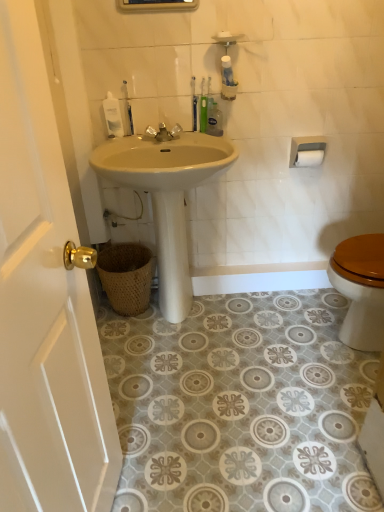
What do you see at coordinates (163, 133) in the screenshot?
I see `metallic faucet at center` at bounding box center [163, 133].

What do you see at coordinates (126, 276) in the screenshot?
I see `woven brown basket at lower left` at bounding box center [126, 276].

Find the location of a particular element. This screenshot has width=384, height=512. woven brown basket at lower left is located at coordinates (126, 276).

Find the location of a particular element. The height and width of the screenshot is (512, 384). white matte soap at upper center is located at coordinates (224, 35).

At what (x,y) coordinates should I click in order to perform the action: click on metallic faucet at center. Please return your answer as a coordinate pair (x, y). This screenshot has height=512, width=384. Looking at the image, I should click on (163, 133).

Is white plastic toilet paper holder at upper right surrounded by white matte toilet paper at upper right?

Definitely not — white plastic toilet paper holder at upper right is not inside white matte toilet paper at upper right.

Is white matte toilet paper at upper right in front of or behind white plastic toilet paper holder at upper right in the image?

In the image, white matte toilet paper at upper right appears behind white plastic toilet paper holder at upper right.

Can you tell me how much white matte toilet paper at upper right and white plastic toilet paper holder at upper right differ in facing direction?

white matte toilet paper at upper right and white plastic toilet paper holder at upper right are facing 1.89 degrees away from each other.

Locate an element on the screen. towel bar in front of the white matte toilet paper at upper right is located at coordinates (307, 151).

Is white plastic soap dispenser at upper left, the first toiletry in the left-to-right sequence, in contact with white glossy door at left?

No, white plastic soap dispenser at upper left, the first toiletry in the left-to-right sequence, is not touching white glossy door at left.

How many degrees apart are the facing directions of white plastic soap dispenser at upper left, the first toiletry in the left-to-right sequence, and white glossy door at left?

The facing directions of white plastic soap dispenser at upper left, the first toiletry in the left-to-right sequence, and white glossy door at left are 81.9 degrees apart.

Can you confirm if white plastic soap dispenser at upper left, the first toiletry in the left-to-right sequence, is shorter than white glossy door at left?

Indeed, white plastic soap dispenser at upper left, the first toiletry in the left-to-right sequence, has a lesser height compared to white glossy door at left.

Considering the sizes of objects white plastic soap dispenser at upper left, the third toiletry positioned from the right, and white glossy door at left in the image provided, who is bigger, white plastic soap dispenser at upper left, the third toiletry positioned from the right, or white glossy door at left?

Bigger between the two is white glossy door at left.

Can you tell me how much white plastic soap dispenser at upper center, which appears as the second toiletry when viewed from the left, and white plastic soap dispenser at upper left, the first toiletry in the left-to-right sequence, differ in facing direction?

0.000408 degrees separate the facing orientations of white plastic soap dispenser at upper center, which appears as the second toiletry when viewed from the left, and white plastic soap dispenser at upper left, the first toiletry in the left-to-right sequence.

From the image's perspective, is white plastic soap dispenser at upper center, which appears as the second toiletry when viewed from the left, below white plastic soap dispenser at upper left, the third toiletry positioned from the right?

Actually, white plastic soap dispenser at upper center, which appears as the second toiletry when viewed from the left, appears above white plastic soap dispenser at upper left, the third toiletry positioned from the right, in the image.

Would you say white plastic soap dispenser at upper center, the 2th toiletry in the right-to-left sequence, is inside or outside white plastic soap dispenser at upper left, the first toiletry in the left-to-right sequence?

white plastic soap dispenser at upper center, the 2th toiletry in the right-to-left sequence, is not enclosed by white plastic soap dispenser at upper left, the first toiletry in the left-to-right sequence.

Considering the points (126, 90) and (121, 120), which point is behind, point (126, 90) or point (121, 120)?

Point (121, 120)

Is point (180, 193) behind point (310, 152)?

That is False.

Looking at the image, does white glossy sink at center seem bigger or smaller compared to white matte toilet paper at upper right?

white glossy sink at center is bigger than white matte toilet paper at upper right.

From a real-world perspective, which object rests below the other?

white glossy sink at center is physically lower.

Does white glossy sink at center come in front of white matte toilet paper at upper right?

Yes, white glossy sink at center is closer to the viewer.

Is point (57, 446) positioned before point (319, 159)?

Yes, point (57, 446) is closer to viewer.

Is white glossy door at left oriented towards white matte toilet paper at upper right?

No, white glossy door at left is not aimed at white matte toilet paper at upper right.

Considering the relative positions of white glossy door at left and white matte toilet paper at upper right in the image provided, is white glossy door at left to the left of white matte toilet paper at upper right from the viewer's perspective?

Yes, white glossy door at left is to the left of white matte toilet paper at upper right.

Does point (117, 109) lie in front of point (216, 128)?

Yes, it is.

Visually, is white plastic soap dispenser at upper left, the first toiletry in the left-to-right sequence, positioned to the left or to the right of translucent plastic bottle at upper center, which is the first toiletry from right to left?

white plastic soap dispenser at upper left, the first toiletry in the left-to-right sequence, is to the left of translucent plastic bottle at upper center, which is the first toiletry from right to left.

From a real-world perspective, is white plastic soap dispenser at upper left, the third toiletry positioned from the right, located higher than translucent plastic bottle at upper center, the third toiletry when ordered from left to right?

Indeed, from a real-world perspective, white plastic soap dispenser at upper left, the third toiletry positioned from the right, stands above translucent plastic bottle at upper center, the third toiletry when ordered from left to right.

Are white plastic soap dispenser at upper left, the third toiletry positioned from the right, and translucent plastic bottle at upper center, the third toiletry when ordered from left to right, making contact?

There is a gap between white plastic soap dispenser at upper left, the third toiletry positioned from the right, and translucent plastic bottle at upper center, the third toiletry when ordered from left to right.

Is white matte soap at upper center further to camera compared to white matte toilet paper at upper right?

That is False.

Is white matte soap at upper center positioned far away from white matte toilet paper at upper right?

white matte soap at upper center is near white matte toilet paper at upper right, not far away.

The image size is (384, 512). Find the location of `toilet paper below the white matte soap at upper center (from a real-world perspective)`. toilet paper below the white matte soap at upper center (from a real-world perspective) is located at coordinates (309, 158).

You are a GUI agent. You are given a task and a screenshot of the screen. Output one action in this format:
    pyautogui.click(x=<x>, y=<y>)
    Task: Click on the toilet paper behind the white plastic toilet paper holder at upper right
    
    Given the screenshot: What is the action you would take?
    pyautogui.click(x=309, y=158)

You are a GUI agent. You are given a task and a screenshot of the screen. Output one action in this format:
    pyautogui.click(x=<x>, y=<y>)
    Task: Click on the toiletry that is the 2nd one when counting upward from the white glossy door at left (from the image's perspective)
    Image resolution: width=384 pixels, height=512 pixels.
    Given the screenshot: What is the action you would take?
    pyautogui.click(x=113, y=116)

Considering their positions, is white matte toilet paper at upper right positioned further to white plastic soap dispenser at upper left, the third toiletry positioned from the right, than white matte soap at upper center?

white matte toilet paper at upper right lies further to white plastic soap dispenser at upper left, the third toiletry positioned from the right, than the other object.

Estimate the real-world distances between objects in this image. Which object is further from white glossy sink at center, translucent plastic bottle at upper center, which is the first toiletry from right to left, or white matte toilet paper at upper right?

Based on the image, white matte toilet paper at upper right appears to be further to white glossy sink at center.

Estimate the real-world distances between objects in this image. Which object is further from white plastic toilet paper holder at upper right, metallic faucet at center or white glossy sink at center?

The object further to white plastic toilet paper holder at upper right is white glossy sink at center.

Considering their positions, is white plastic soap dispenser at upper left, the first toiletry in the left-to-right sequence, positioned closer to white glossy sink at center than white glossy door at left?

white plastic soap dispenser at upper left, the first toiletry in the left-to-right sequence.

When comparing their distances from white plastic toilet paper holder at upper right, does white plastic soap dispenser at upper left, the third toiletry positioned from the right, or white glossy sink at center seem further?

Based on the image, white plastic soap dispenser at upper left, the third toiletry positioned from the right, appears to be further to white plastic toilet paper holder at upper right.

In the scene shown: Based on their spatial positions, is metallic faucet at center or white plastic soap dispenser at upper left, the first toiletry in the left-to-right sequence, closer to white matte soap at upper center?

Among the two, metallic faucet at center is located nearer to white matte soap at upper center.

Which object lies further to the anchor point matte white medicine cabinet at upper center, translucent plastic bottle at upper center, which is the first toiletry from right to left, or metallic faucet at center?

metallic faucet at center.

From the picture: Which object lies further to the anchor point white glossy sink at center, metallic faucet at center or white plastic soap dispenser at upper left, the third toiletry positioned from the right?

white plastic soap dispenser at upper left, the third toiletry positioned from the right, is positioned further to the anchor white glossy sink at center.

You are a GUI agent. You are given a task and a screenshot of the screen. Output one action in this format:
    pyautogui.click(x=<x>, y=<y>)
    Task: Click on the toiletry between white glossy sink at center and white plastic toilet paper holder at upper right
    This screenshot has height=512, width=384.
    Given the screenshot: What is the action you would take?
    pyautogui.click(x=214, y=119)

Where is `tap situated between white plastic soap dispenser at upper left, the third toiletry positioned from the right, and white plastic toilet paper holder at upper right from left to right`? The height and width of the screenshot is (512, 384). tap situated between white plastic soap dispenser at upper left, the third toiletry positioned from the right, and white plastic toilet paper holder at upper right from left to right is located at coordinates (163, 133).

Find the location of a particular element. soap located between white glossy door at left and metallic faucet at center in the depth direction is located at coordinates (224, 35).

I want to click on tap situated between white plastic soap dispenser at upper center, the 2th toiletry in the right-to-left sequence, and white plastic toilet paper holder at upper right from left to right, so click(x=163, y=133).